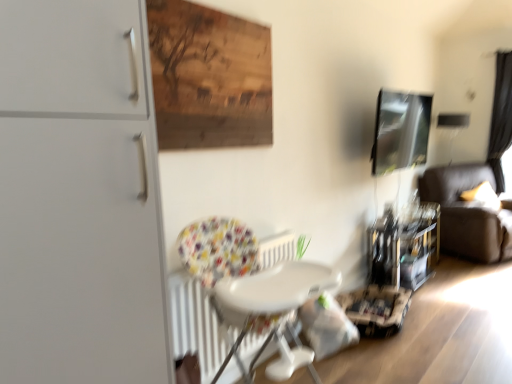
What are the coordinates of `dark brown leather couch at right` in the screenshot? It's located at (468, 213).

Where is `white plastic chair at center`? The width and height of the screenshot is (512, 384). white plastic chair at center is located at coordinates (250, 290).

This screenshot has height=384, width=512. What do you see at coordinates (209, 77) in the screenshot? I see `wooden panel at upper center` at bounding box center [209, 77].

At what (x,y) coordinates should I click in order to perform the action: click on wooden panel at upper center. Please return your answer as a coordinate pair (x, y). This screenshot has width=512, height=384. Looking at the image, I should click on (209, 77).

Describe the element at coordinates (501, 117) in the screenshot. I see `black fabric curtain at right` at that location.

Locate an element on the screen. The width and height of the screenshot is (512, 384). metallic glossy picture frame at upper right is located at coordinates (400, 131).

This screenshot has height=384, width=512. What are the coordinates of `dark brown leather couch at right` in the screenshot? It's located at (468, 213).

Identify the location of dresser lying below the metallic glossy picture frame at upper right (from the image's perspective). The image size is (512, 384). (80, 197).

Is point (416, 96) farther from camera compared to point (123, 15)?

Yes, point (416, 96) is farther from viewer.

From a real-world perspective, which is physically below, metallic glossy picture frame at upper right or matte white cabinet at left?

matte white cabinet at left.

Is point (501, 188) closer or farther from the camera than point (218, 318)?

Point (501, 188) appears to be farther away from the viewer than point (218, 318).

Is black fabric curtain at right not inside white plastic chair at center?

Yes, black fabric curtain at right is outside of white plastic chair at center.

In terms of height, does black fabric curtain at right look taller or shorter compared to white plastic chair at center?

Considering their sizes, black fabric curtain at right has more height than white plastic chair at center.

Is black fabric curtain at right to the right of white plastic chair at center from the viewer's perspective?

Correct, you'll find black fabric curtain at right to the right of white plastic chair at center.

Would you say white plastic chair at center is inside or outside wooden panel at upper center?

white plastic chair at center is located beyond the bounds of wooden panel at upper center.

Considering the sizes of white plastic chair at center and wooden panel at upper center in the image, is white plastic chair at center taller or shorter than wooden panel at upper center?

In the image, white plastic chair at center appears to be taller than wooden panel at upper center.

Does point (283, 288) appear closer or farther from the camera than point (193, 58)?

Point (283, 288) appears to be closer to the viewer than point (193, 58).

Is white plastic chair at center to the left or to the right of wooden panel at upper center in the image?

Based on their positions, white plastic chair at center is located to the right of wooden panel at upper center.

Is metallic glossy picture frame at upper right not close to wooden panel at upper center?

That's right, there is a large distance between metallic glossy picture frame at upper right and wooden panel at upper center.

Locate an element on the screen. This screenshot has width=512, height=384. plywood in front of the metallic glossy picture frame at upper right is located at coordinates (209, 77).

How far apart are metallic glossy picture frame at upper right and wooden panel at upper center?

The distance of metallic glossy picture frame at upper right from wooden panel at upper center is 7.41 feet.

Is metallic glossy picture frame at upper right completely or partially outside of wooden panel at upper center?

That's correct, metallic glossy picture frame at upper right is outside of wooden panel at upper center.

In the image, there is a wooden panel at upper center. Identify the location of studio couch below it (from the image's perspective). tap(468, 213).

Which point is more forward, (231,126) or (426,174)?

The point (231,126) is closer to the camera.

Is wooden panel at upper center positioned before dark brown leather couch at right?

That is True.

From a real-world perspective, relative to dark brown leather couch at right, is wooden panel at upper center vertically above or below?

wooden panel at upper center is above dark brown leather couch at right.

Is metallic glossy picture frame at upper right next to dark brown leather couch at right?

A: No, metallic glossy picture frame at upper right is not touching dark brown leather couch at right.

Consider the image. Considering the relative sizes of metallic glossy picture frame at upper right and dark brown leather couch at right in the image provided, is metallic glossy picture frame at upper right bigger than dark brown leather couch at right?

Incorrect, metallic glossy picture frame at upper right is not larger than dark brown leather couch at right.

Could you tell me if metallic glossy picture frame at upper right is turned towards dark brown leather couch at right?

No.

In the scene shown: Is metallic glossy picture frame at upper right situated inside dark brown leather couch at right or outside?

metallic glossy picture frame at upper right is not inside dark brown leather couch at right, it's outside.

What's the angular difference between wooden panel at upper center and black fabric curtain at right's facing directions?

The facing directions of wooden panel at upper center and black fabric curtain at right are 90 degrees apart.

In terms of width, does wooden panel at upper center look wider or thinner when compared to black fabric curtain at right?

Considering their sizes, wooden panel at upper center looks slimmer than black fabric curtain at right.

From the image's perspective, is wooden panel at upper center located above or below black fabric curtain at right?

Based on their image positions, wooden panel at upper center is located beneath black fabric curtain at right.

This screenshot has height=384, width=512. Identify the location of dresser located on the left of metallic glossy picture frame at upper right. (80, 197).

Identify the location of curtain that appears above the white plastic chair at center (from a real-world perspective). The image size is (512, 384). (501, 117).

When comparing their distances from dark brown leather couch at right, does white plastic chair at center or matte white cabinet at left seem closer?

The object closer to dark brown leather couch at right is white plastic chair at center.

Estimate the real-world distances between objects in this image. Which object is closer to wooden panel at upper center, dark brown leather couch at right or metallic glossy picture frame at upper right?

The object closer to wooden panel at upper center is metallic glossy picture frame at upper right.

Estimate the real-world distances between objects in this image. Which object is further from black fabric curtain at right, dark brown leather couch at right or white plastic chair at center?

white plastic chair at center is further to black fabric curtain at right.

Estimate the real-world distances between objects in this image. Which object is further from wooden panel at upper center, black fabric curtain at right or metallic glossy picture frame at upper right?

The object further to wooden panel at upper center is black fabric curtain at right.

Looking at the image, which one is located closer to black fabric curtain at right, white plastic chair at center or dark brown leather couch at right?

dark brown leather couch at right is closer to black fabric curtain at right.

From the image, which object appears to be farther from white plastic chair at center, wooden panel at upper center or metallic glossy picture frame at upper right?

metallic glossy picture frame at upper right is further to white plastic chair at center.

In the scene shown: From the image, which object appears to be farther from white plastic chair at center, metallic glossy picture frame at upper right or matte white cabinet at left?

Based on the image, metallic glossy picture frame at upper right appears to be further to white plastic chair at center.

Estimate the real-world distances between objects in this image. Which object is further from black fabric curtain at right, dark brown leather couch at right or wooden panel at upper center?

The object further to black fabric curtain at right is wooden panel at upper center.

Locate an element on the screen. This screenshot has height=384, width=512. chair between matte white cabinet at left and dark brown leather couch at right along the z-axis is located at coordinates point(250,290).

You are a GUI agent. You are given a task and a screenshot of the screen. Output one action in this format:
    pyautogui.click(x=<x>, y=<y>)
    Task: Click on the plywood between matte white cabinet at left and dark brown leather couch at right from left to right
    The image size is (512, 384).
    Given the screenshot: What is the action you would take?
    pyautogui.click(x=209, y=77)

This screenshot has height=384, width=512. Find the location of `plywood positioned between matte white cabinet at left and metallic glossy picture frame at upper right from near to far`. plywood positioned between matte white cabinet at left and metallic glossy picture frame at upper right from near to far is located at coordinates (209, 77).

I want to click on studio couch between white plastic chair at center and black fabric curtain at right along the z-axis, so click(x=468, y=213).